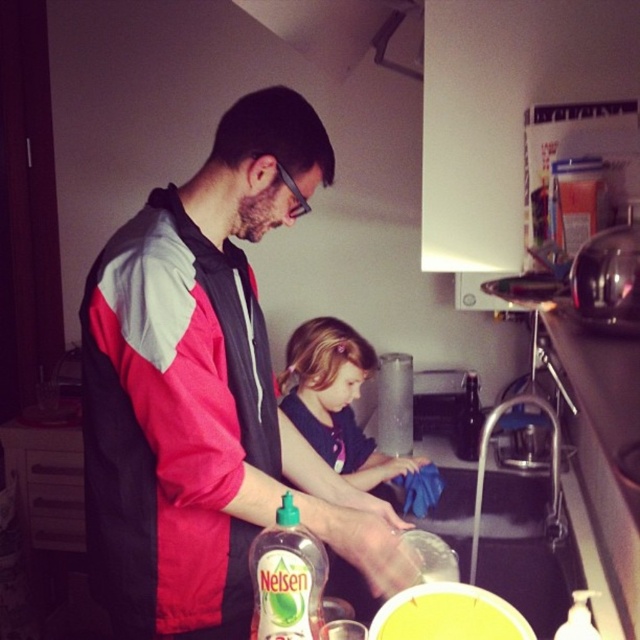
Is matte red jacket at center closer to camera compared to brushed metal exhaust hood at upper center?

That is True.

Is point (88, 388) closer to camera compared to point (378, 54)?

Yes, point (88, 388) is in front of point (378, 54).

Who is more forward, (193, 260) or (320, 67)?

Positioned in front is point (193, 260).

This screenshot has width=640, height=640. Find the location of `matte red jacket at center`. matte red jacket at center is located at coordinates (204, 392).